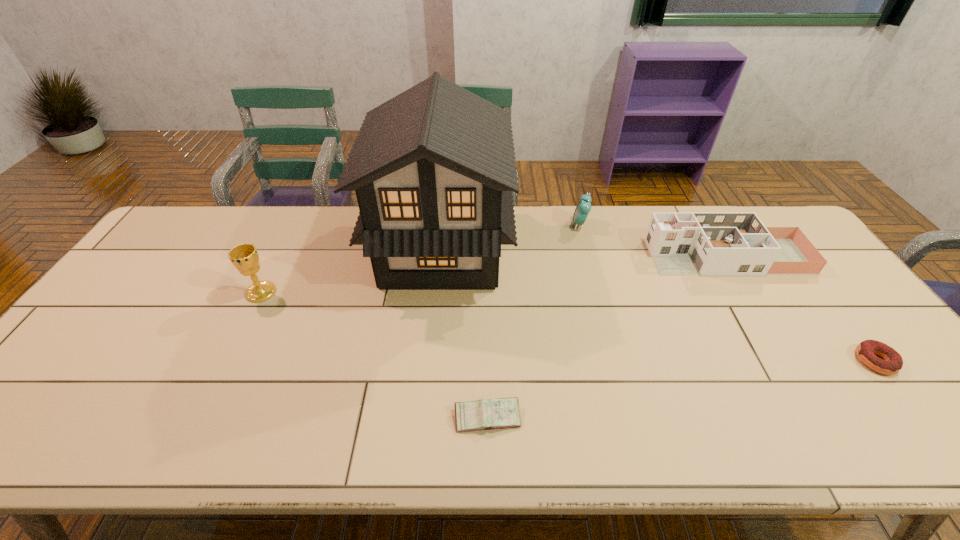
You are a GUI agent. You are given a task and a screenshot of the screen. Output one action in this format:
    pyautogui.click(x=<x>, y=<y>)
    Task: Click on the alarm clock that is at the far edge
    The height and width of the screenshot is (540, 960).
    Given the screenshot: What is the action you would take?
    pyautogui.click(x=583, y=207)

Find the location of `object that is at the near edge`. object that is at the near edge is located at coordinates (500, 413).

Find the location of a particular element. The width and height of the screenshot is (960, 540). dollhouse positioned at the right edge is located at coordinates (708, 244).

The image size is (960, 540). In order to click on doughnut that is at the right edge in this screenshot , I will do `click(892, 364)`.

The image size is (960, 540). In order to click on object that is at the far right corner in this screenshot , I will do `click(708, 244)`.

Where is `blank space at the far edge of the desktop`? The height and width of the screenshot is (540, 960). blank space at the far edge of the desktop is located at coordinates (269, 228).

Locate an element on the screen. The image size is (960, 540). vacant region at the near edge of the desktop is located at coordinates (248, 449).

Where is `vacant space at the left edge of the desktop`? The width and height of the screenshot is (960, 540). vacant space at the left edge of the desktop is located at coordinates (157, 276).

This screenshot has width=960, height=540. What are the coordinates of `free space between the diary and the right dollhouse` in the screenshot? It's located at (608, 337).

Where is `vacant region between the fifth shortest object and the fifth farthest object`? The width and height of the screenshot is (960, 540). vacant region between the fifth shortest object and the fifth farthest object is located at coordinates (568, 327).